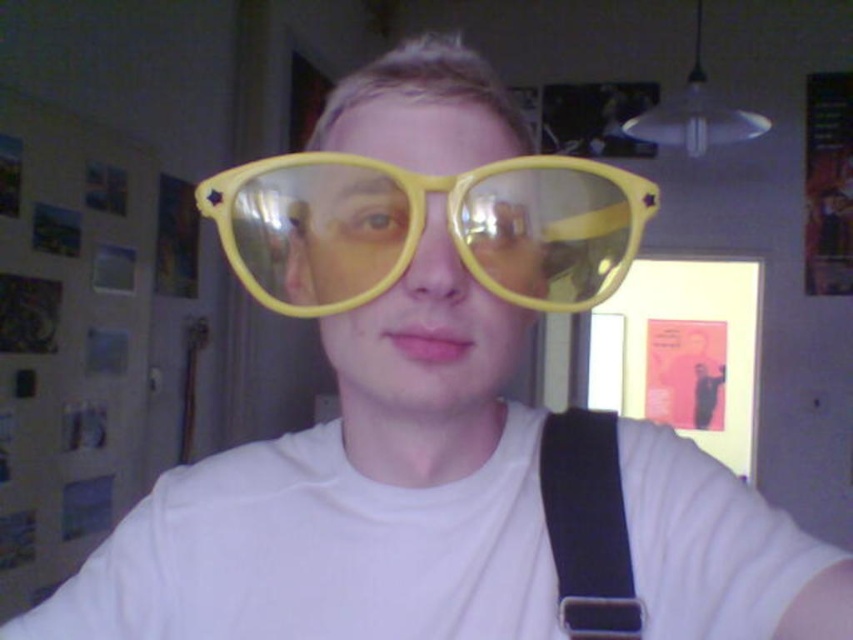
Question: Does yellow plastic goggles at center have a larger size compared to black fabric strap at center?

Choices:
 (A) no
 (B) yes

Answer: (B)

Question: Where is yellow plastic goggles at center located in relation to black fabric strap at center in the image?

Choices:
 (A) right
 (B) left

Answer: (B)

Question: Does yellow plastic goggles at center have a larger size compared to black fabric strap at center?

Choices:
 (A) yes
 (B) no

Answer: (A)

Question: Which point appears closest to the camera in this image?

Choices:
 (A) (546, 509)
 (B) (345, 250)

Answer: (B)